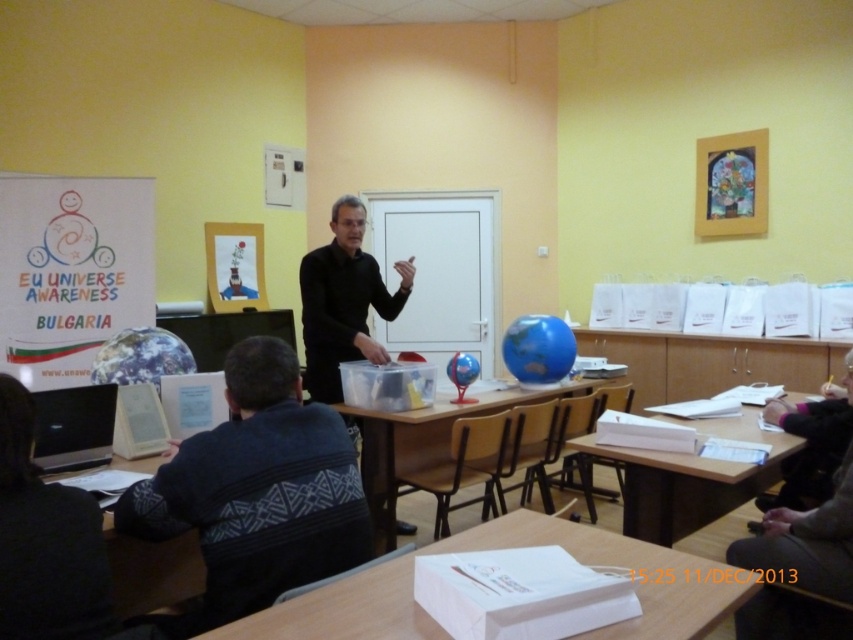
Question: Does wooden table at lower right come behind black matte/black shirt at center?

Choices:
 (A) yes
 (B) no

Answer: (B)

Question: Which object is closer to the camera taking this photo?

Choices:
 (A) dark blue sweater at lower left
 (B) wooden table at center
 (C) wooden table at lower right

Answer: (A)

Question: Can you confirm if white paper at lower center is positioned to the left of wooden table at lower left?

Choices:
 (A) no
 (B) yes

Answer: (A)

Question: Is dark blue sweater at lower left to the right of wooden table at center from the viewer's perspective?

Choices:
 (A) no
 (B) yes

Answer: (A)

Question: Estimate the real-world distances between objects in this image. Which object is farther from the wooden table at center?

Choices:
 (A) dark blue sweater at lower left
 (B) white paper at lower center
 (C) black matte/black shirt at center
 (D) wooden table at lower right

Answer: (B)

Question: Which of the following is the closest to the observer?

Choices:
 (A) (354, 561)
 (B) (129, 563)
 (C) (310, 252)

Answer: (A)